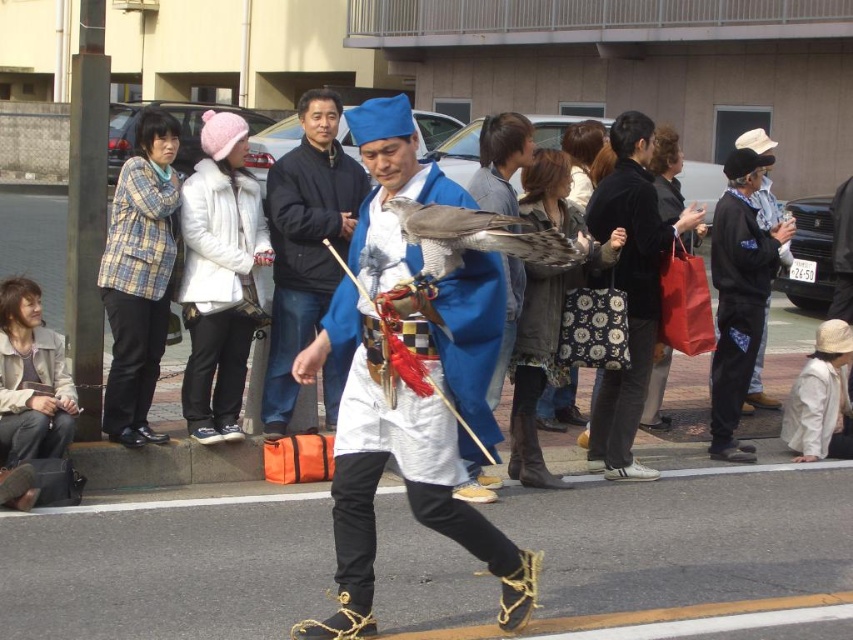
You are a photographer trying to capture the person in the blue silk kimono at center and the blue fabric kimono at center. Which kimono should you focus on to ensure it fits entirely within your camera frame if your current frame can only accommodate the wider of the two?

The blue silk kimono at center has a larger width than the blue fabric kimono at center, so focusing on the blue silk kimono at center ensures it fits within the camera frame since it is wider.

You are a photographer trying to capture the plaid fabric jacket at left in the scene. Based on its position, where should you aim your camera?

The plaid fabric jacket at left is located at point (137,289), so aim your camera at those coordinates to capture it.